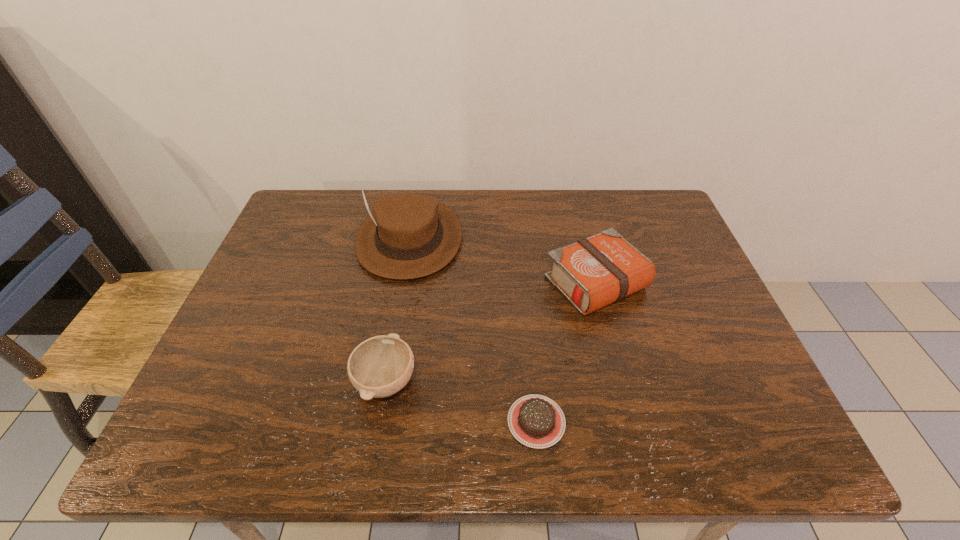
The image size is (960, 540). In order to click on fedora in this screenshot , I will do `click(407, 236)`.

Locate an element on the screen. Bible is located at coordinates (593, 272).

Image resolution: width=960 pixels, height=540 pixels. Find the location of `bowl`. bowl is located at coordinates (380, 366).

Find the location of `the shortest object`. the shortest object is located at coordinates (536, 421).

Identify the location of chocolate cake. (536, 421).

Locate an element on the screen. This screenshot has height=540, width=960. blank area located 0.050m on the feather side of the tallest object is located at coordinates (399, 297).

Identify the location of vacant space situated 0.230m on the back of the rightmost object. (575, 202).

At what (x,y) coordinates should I click in order to perform the action: click on blank space located 0.340m on the right of the bowl. Please return your answer as a coordinate pair (x, y). The image size is (960, 540). Looking at the image, I should click on (577, 381).

At what (x,y) coordinates should I click in order to perform the action: click on vacant space located on the left of the chocolate cake. Please return your answer as a coordinate pair (x, y). Looking at the image, I should click on (421, 421).

Image resolution: width=960 pixels, height=540 pixels. In order to click on object at the far edge in this screenshot , I will do `click(407, 236)`.